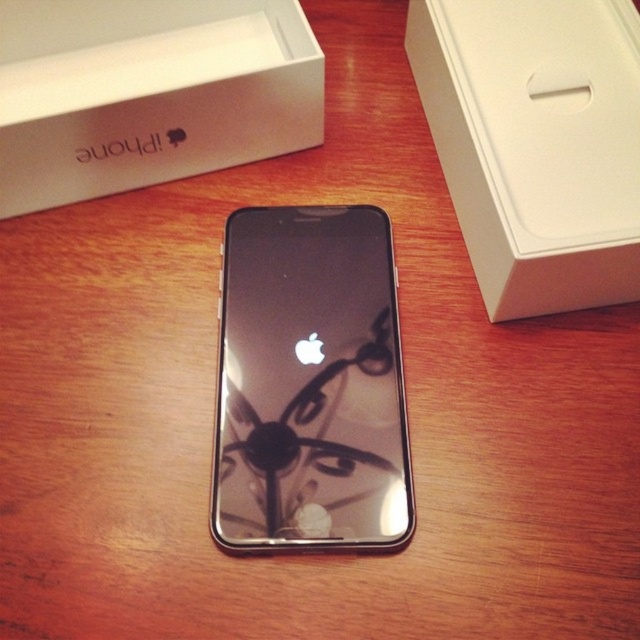
Question: Which point appears closest to the camera in this image?

Choices:
 (A) (545, 182)
 (B) (339, 403)

Answer: (A)

Question: Estimate the real-world distances between objects in this image. Which object is closer to the white matte box at upper right?

Choices:
 (A) sleek black phone at center
 (B) white matte iphone box at upper left

Answer: (A)

Question: Which of the following is the farthest from the observer?

Choices:
 (A) (378, 484)
 (B) (483, 177)
 (C) (122, 104)

Answer: (C)

Question: Does sleek black phone at center lie in front of white matte iphone box at upper left?

Choices:
 (A) no
 (B) yes

Answer: (B)

Question: Observing the image, what is the correct spatial positioning of white matte box at upper right in reference to white matte iphone box at upper left?

Choices:
 (A) above
 (B) below

Answer: (B)

Question: Does sleek black phone at center come behind white matte iphone box at upper left?

Choices:
 (A) yes
 (B) no

Answer: (B)